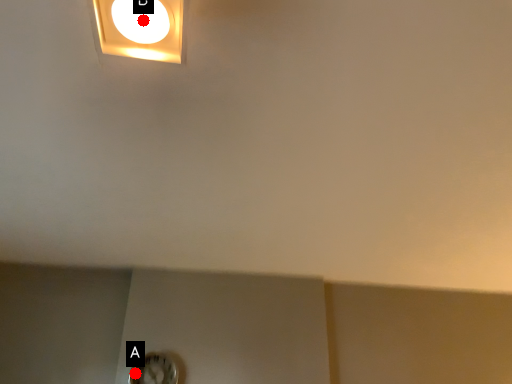
Question: Two points are circled on the image, labeled by A and B beside each circle. Which point is further to the camera?

Choices:
 (A) A is further
 (B) B is further

Answer: (A)